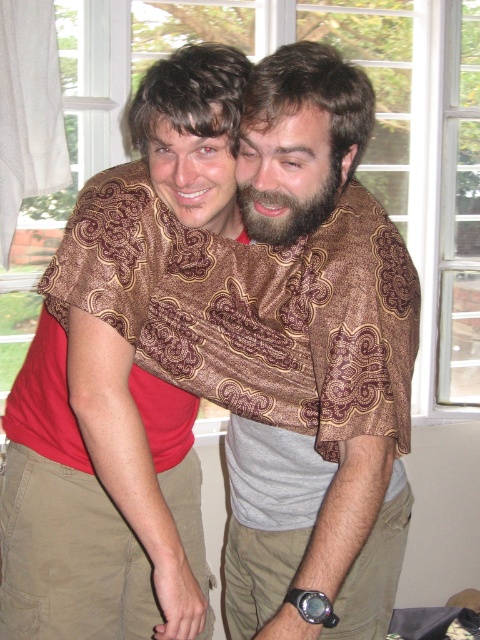
You are standing in the room and want to move from the point at coordinates point [381,413] to the point at coordinates point [279,188]. Which direction should you move to reach your destination?

To move from point [381,413] to point [279,188], you should move northeast because point [381,413] is behind point [279,188].

From the picture: You are taking a photo of two people standing indoors. You notice the brown patterned scarf at center and the brown fuzzy beard at center. Which object is positioned more to the right in the image?

The brown patterned scarf at center is to the right of the brown fuzzy beard at center, so the brown patterned scarf at center is positioned more to the right.